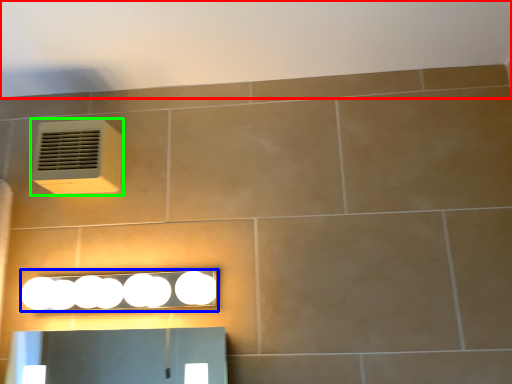
Question: Considering the real-world distances, which object is closest to backdrop (highlighted by a red box)? light fixture (highlighted by a blue box) or air conditioning (highlighted by a green box).

Choices:
 (A) light fixture
 (B) air conditioning

Answer: (B)